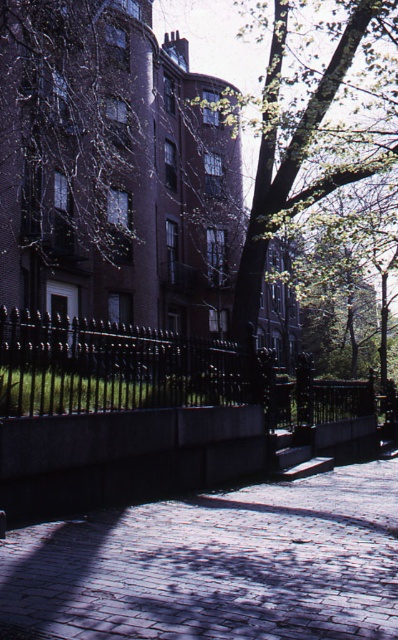
From the picture: Can you confirm if cobblestone pavement at center is shorter than green leafy tree at upper center?

Yes, cobblestone pavement at center is shorter than green leafy tree at upper center.

Can you confirm if cobblestone pavement at center is wider than green leafy tree at upper center?

In fact, cobblestone pavement at center might be narrower than green leafy tree at upper center.

Which is behind, point (337, 634) or point (267, 248)?

The point (267, 248) is behind.

Identify the location of cobblestone pavement at center. Image resolution: width=398 pixels, height=640 pixels. (216, 564).